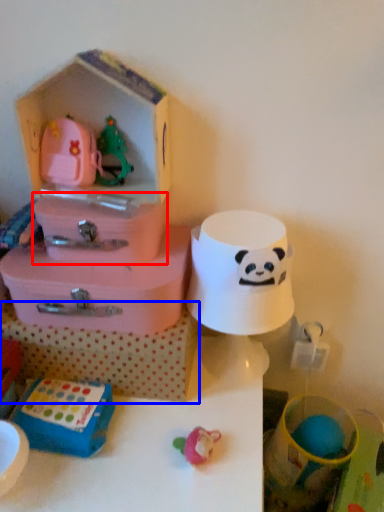
Question: Which object appears farthest to the camera in this image, storage box (highlighted by a red box) or storage box (highlighted by a blue box)?

Choices:
 (A) storage box
 (B) storage box

Answer: (B)